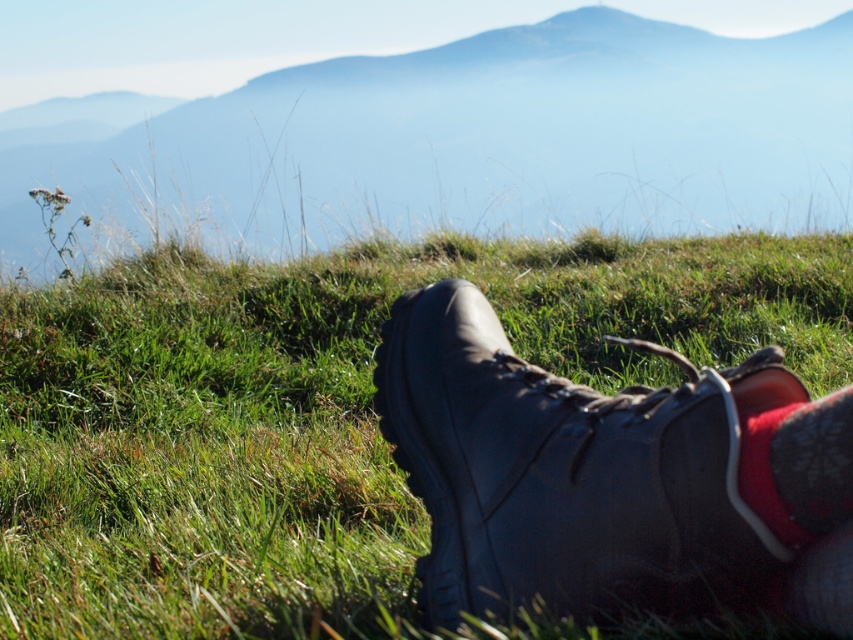
Is green grass at lower left wider than red suede sock at lower right?

Indeed, green grass at lower left has a greater width compared to red suede sock at lower right.

Which is more to the left, green grass at lower left or red suede sock at lower right?

green grass at lower left

Which is in front, point (688, 120) or point (750, 492)?

Point (750, 492)

The image size is (853, 640). Identify the location of green grass at lower left. (473, 140).

Does green grass at lower center have a lesser height compared to green grass at lower left?

Indeed, green grass at lower center has a lesser height compared to green grass at lower left.

Between green grass at lower center and green grass at lower left, which one has less height?

green grass at lower center is shorter.

Does point (144, 353) come closer to viewer compared to point (689, 106)?

Yes, it is in front of point (689, 106).

At what (x,y) coordinates should I click in order to perform the action: click on green grass at lower center. Please return your answer as a coordinate pair (x, y). Looking at the image, I should click on (317, 413).

Which of these two, green grass at lower center or leather boot at lower center, stands shorter?

green grass at lower center

Who is more forward, (204, 301) or (592, 582)?

Positioned in front is point (592, 582).

Who is more distant from viewer, (300, 600) or (637, 573)?

Positioned behind is point (300, 600).

Locate an element on the screen. green grass at lower center is located at coordinates (317, 413).